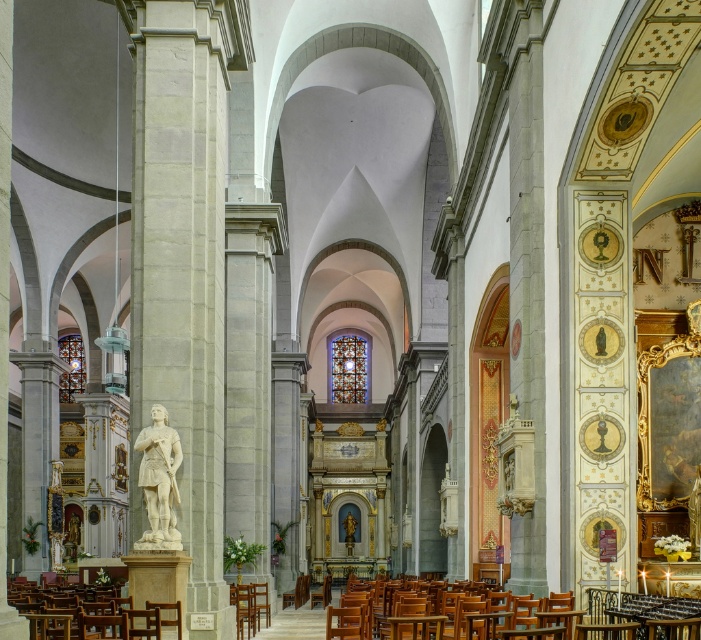
Looking at this image, you are standing in the nave of the church and want to walk from your current position to the altar at the far end. There is a white marble statue at center and a wooden polished chair at lower left in your path. Which object will you encounter first as you move towards the altar?

The wooden polished chair at lower left will be encountered first because the white marble statue at center is further away from the viewer compared to the wooden polished chair at lower left, meaning the chair is closer to the starting point near the nave.